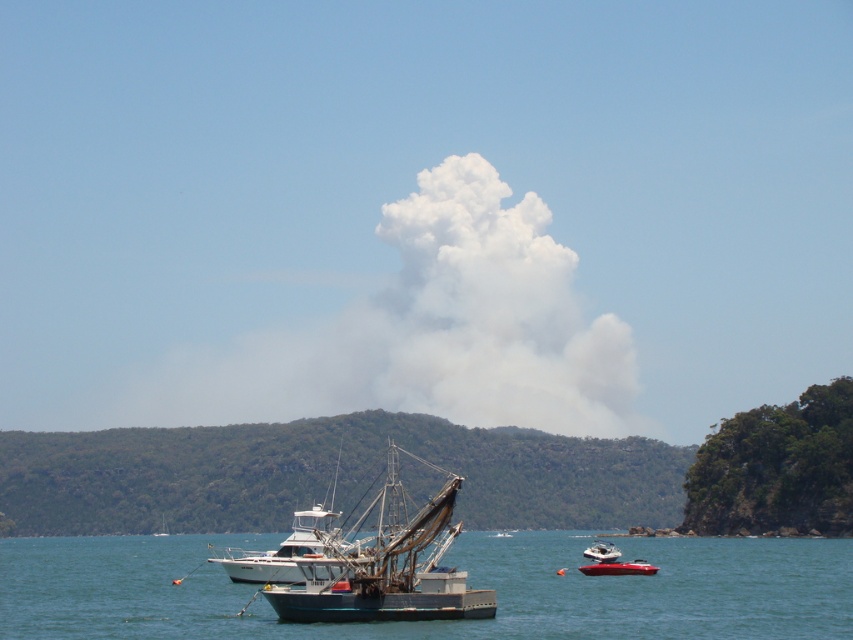
You are a sailor observing the coastal scene. You notice the white smoke cloud at center and the blue metallic fishing boat at center. Which object is located above the other?

The white smoke cloud at center is positioned over the blue metallic fishing boat at center, meaning it is above the boat.

You are a sailor observing the scene from the shore. You notice the white smoke cloud at center and the metallic silver boat at lower right. Which object is closer to the left side of your view?

The white smoke cloud at center is to the left of metallic silver boat at lower right, so the white smoke cloud at center is closer to the left side of your view.